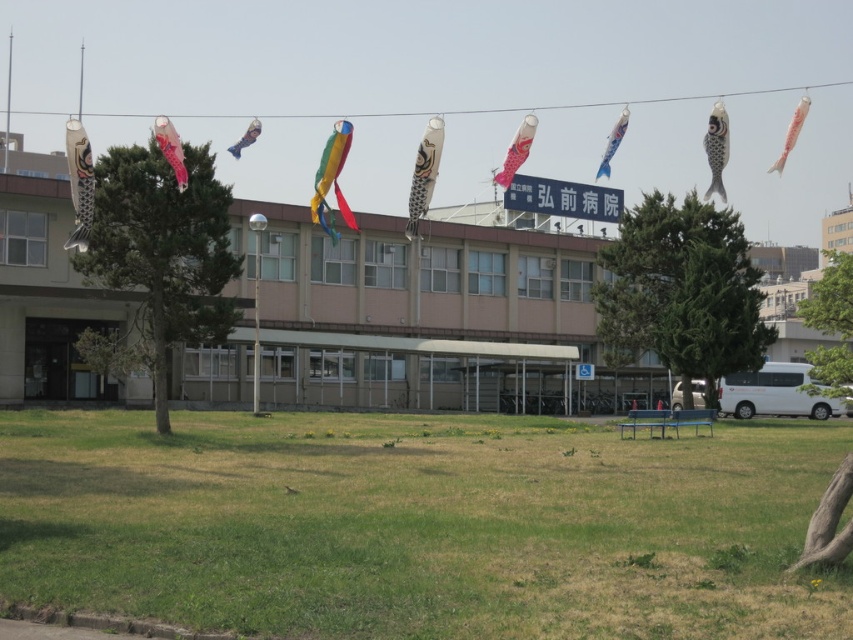
Which is more to the left, pink fabric kite at upper left or white matte kite at upper right?

pink fabric kite at upper left is more to the left.

Can you confirm if pink fabric kite at upper left is thinner than white matte kite at upper right?

Yes, pink fabric kite at upper left is thinner than white matte kite at upper right.

Measure the distance between point [180,148] and camera.

17.42 meters

This screenshot has height=640, width=853. I want to click on pink fabric kite at upper left, so click(170, 148).

Does green textured tree at center appear under matte blue kite at upper center?

Yes.

Can you confirm if green textured tree at center is positioned to the right of matte blue kite at upper center?

Correct, you'll find green textured tree at center to the right of matte blue kite at upper center.

Which is behind, point (730, 227) or point (257, 132)?

Positioned behind is point (257, 132).

Find the location of `green textured tree at center`. green textured tree at center is located at coordinates (682, 291).

Is the position of white paper kite at center more distant than that of matte blue kite at upper center?

No, white paper kite at center is closer to the viewer.

Which is above, white paper kite at center or matte blue kite at upper center?

matte blue kite at upper center is higher up.

Is point (433, 120) closer to viewer compared to point (256, 125)?

Yes, point (433, 120) is closer to viewer.

Locate an element on the screen. white paper kite at center is located at coordinates (424, 173).